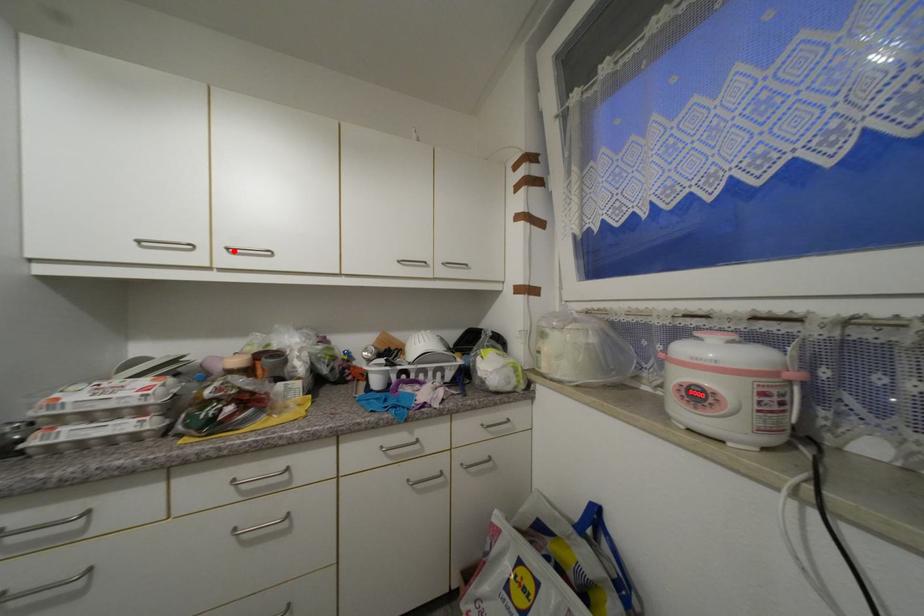
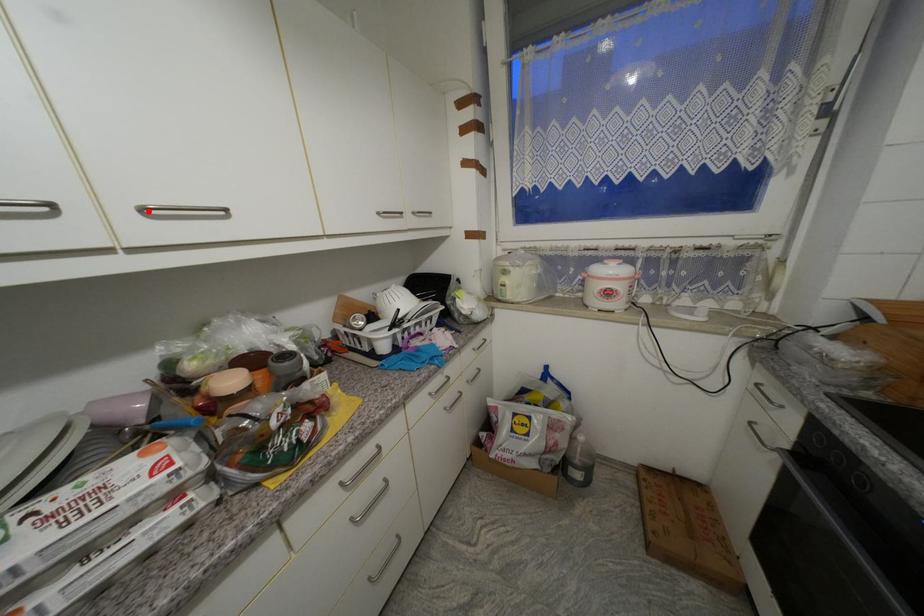
I am providing you with two images of the same scene from different viewpoints. A red point is marked on the first image and another point is marked on the second image. Is the red point in image1 aligned with the point shown in image2?

Yes